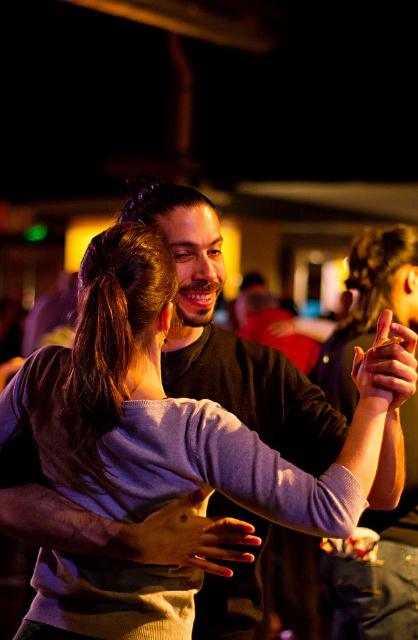
Question: Is brown hair at center positioned before smooth skin hand at center?

Choices:
 (A) no
 (B) yes

Answer: (A)

Question: Can you confirm if purple ribbed sweater at center is positioned above brown hair at center?

Choices:
 (A) no
 (B) yes

Answer: (A)

Question: Is purple sweater at center positioned behind smooth skin hand at center?

Choices:
 (A) no
 (B) yes

Answer: (B)

Question: Which point is closer to the camera taking this photo?

Choices:
 (A) (374, 378)
 (B) (211, 529)
 (C) (415, 291)
 (D) (331, 422)

Answer: (B)

Question: Which point is farther to the camera?

Choices:
 (A) purple sweater at center
 (B) smooth skin hand at center

Answer: (A)

Question: Which of the following is the farthest from the observer?

Choices:
 (A) purple ribbed sweater at center
 (B) smooth skin hand at center
 (C) matte purple sweater at center

Answer: (A)